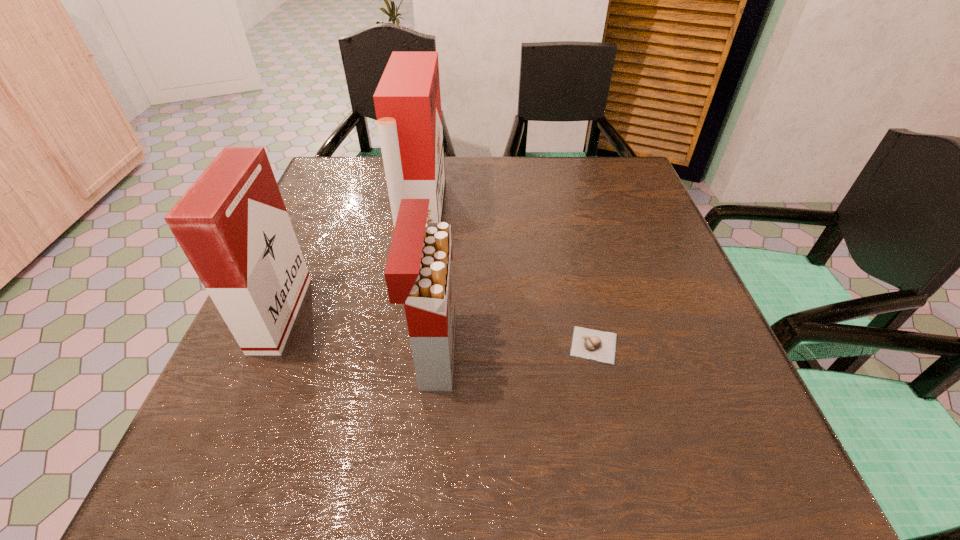
The image size is (960, 540). Find the location of `the third closest object relative to the leftmost cigarette case`. the third closest object relative to the leftmost cigarette case is located at coordinates (589, 344).

The width and height of the screenshot is (960, 540). Find the location of `cigarette case that is the second closest to the farthest cigarette case`. cigarette case that is the second closest to the farthest cigarette case is located at coordinates (232, 224).

Locate which cigarette case is the second closest to the garlic. Please provide its 2D coordinates. Your answer should be formatted as a tuple, i.e. [(x, y)], where the tuple contains the x and y coordinates of a point satisfying the conditions above.

[(407, 100)]

Where is `free space that satisfies the following two spatial constraints: 1. on the front-facing side of the farthest cigarette case; 2. on the right side of the shortest object`? free space that satisfies the following two spatial constraints: 1. on the front-facing side of the farthest cigarette case; 2. on the right side of the shortest object is located at coordinates (401, 345).

I want to click on free space that satisfies the following two spatial constraints: 1. on the front-facing side of the leftmost cigarette case; 2. on the back side of the garlic, so click(267, 345).

At what (x,y) coordinates should I click in order to perform the action: click on vacant area that satisfies the following two spatial constraints: 1. on the front-facing side of the leftmost cigarette case; 2. on the right side of the rightmost object. Please return your answer as a coordinate pair (x, y). The height and width of the screenshot is (540, 960). Looking at the image, I should click on (267, 345).

The height and width of the screenshot is (540, 960). I want to click on vacant point that satisfies the following two spatial constraints: 1. on the front-facing side of the rightmost object; 2. on the right side of the farthest object, so click(x=401, y=345).